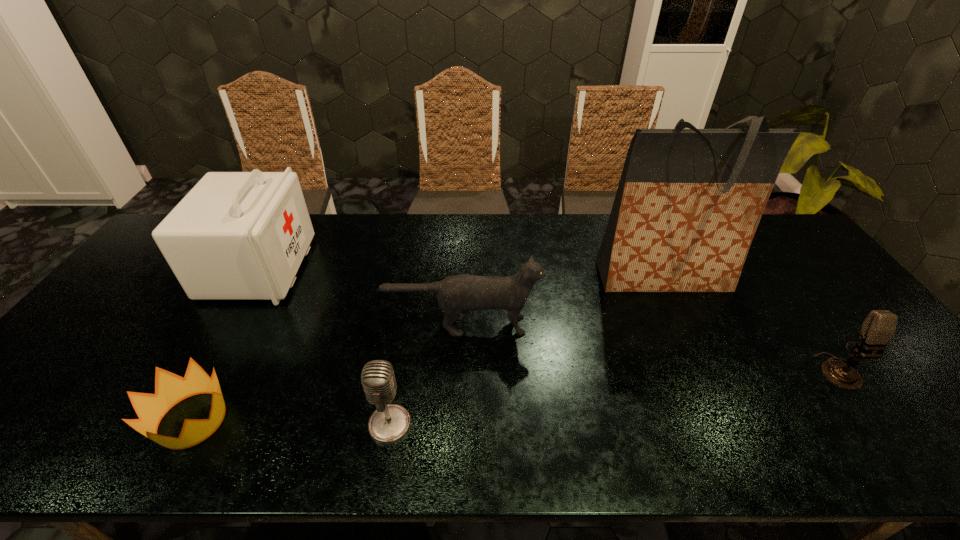
Find the location of a particular element. Image resolution: width=960 pixels, height=540 pixels. free spot at the near edge of the desktop is located at coordinates (248, 451).

The height and width of the screenshot is (540, 960). In order to click on free spot at the left edge of the desktop in this screenshot , I will do `click(85, 354)`.

The image size is (960, 540). I want to click on empty space between the first-aid kit and the cat, so click(361, 296).

Find the location of a particular element. vacant area that lies between the nearer microphone and the fifth object from left to right is located at coordinates (526, 352).

Where is `unoccupied area between the shortest object and the right microphone`? The height and width of the screenshot is (540, 960). unoccupied area between the shortest object and the right microphone is located at coordinates (513, 395).

Locate an element on the screen. free area in between the first-aid kit and the nearer microphone is located at coordinates (324, 346).

Locate an element on the screen. Image resolution: width=960 pixels, height=540 pixels. unoccupied position between the second tallest object and the nearer microphone is located at coordinates (324, 346).

Locate an element on the screen. The width and height of the screenshot is (960, 540). vacant area that lies between the crown and the shopping bag is located at coordinates (427, 349).

The width and height of the screenshot is (960, 540). What are the coordinates of `vacant region between the crown and the right microphone` in the screenshot? It's located at (513, 395).

The width and height of the screenshot is (960, 540). Find the location of `free space between the left microphone and the third farthest object`. free space between the left microphone and the third farthest object is located at coordinates (426, 375).